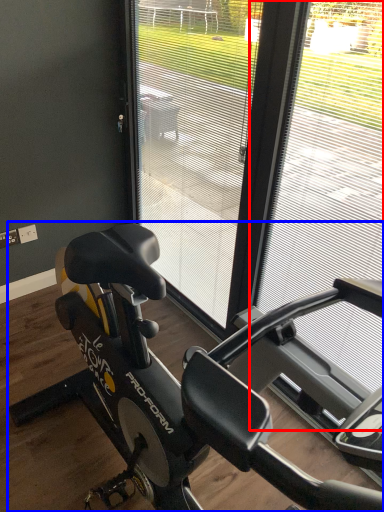
Question: Among these objects, which one is farthest to the camera, window frame (highlighted by a red box) or stationary bicycle (highlighted by a blue box)?

Choices:
 (A) window frame
 (B) stationary bicycle

Answer: (B)